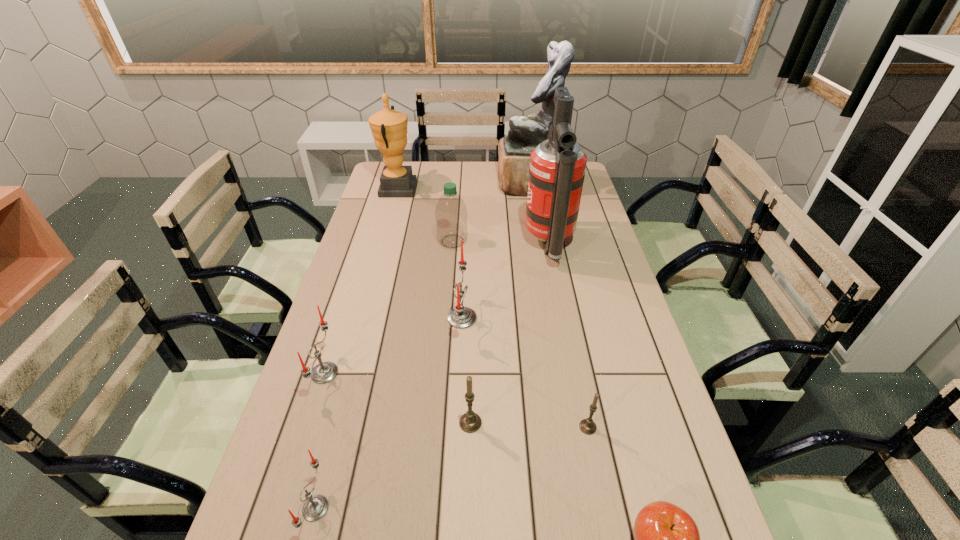
Locate an element on the screen. The height and width of the screenshot is (540, 960). the smaller gray candle is located at coordinates (587, 426).

You are a GUI agent. You are given a task and a screenshot of the screen. Output one action in this format:
    pyautogui.click(x=<x>, y=<y>)
    Task: Click on the right gray candle
    This screenshot has height=540, width=960.
    Given the screenshot: What is the action you would take?
    pyautogui.click(x=587, y=426)

Where is `vacant space located in a relaxed pose on the sculpture`? The height and width of the screenshot is (540, 960). vacant space located in a relaxed pose on the sculpture is located at coordinates (468, 185).

The height and width of the screenshot is (540, 960). I want to click on free space located 0.350m in a relaxed pose on the sculpture, so click(419, 185).

Locate an element on the screen. The image size is (960, 540). free space located in a relaxed pose on the sculpture is located at coordinates (434, 185).

The width and height of the screenshot is (960, 540). Identify the location of vacant space located 0.120m on the front label side of the fire extinguisher. (492, 245).

Where is `free spot located on the front label side of the fire extinguisher`? Image resolution: width=960 pixels, height=540 pixels. free spot located on the front label side of the fire extinguisher is located at coordinates (442, 245).

The image size is (960, 540). Identify the location of free space located 0.090m on the front label side of the fire extinguisher. (499, 245).

You are a GUI agent. You are given a task and a screenshot of the screen. Output one action in this format:
    pyautogui.click(x=<x>, y=<y>)
    Task: Click on the free space located at the front of the eighth shortest object with handles
    The width and height of the screenshot is (960, 540).
    Given the screenshot: What is the action you would take?
    pyautogui.click(x=452, y=189)

Image resolution: width=960 pixels, height=540 pixels. In order to click on vacant space located on the left of the green water bottle in this screenshot , I will do `click(404, 241)`.